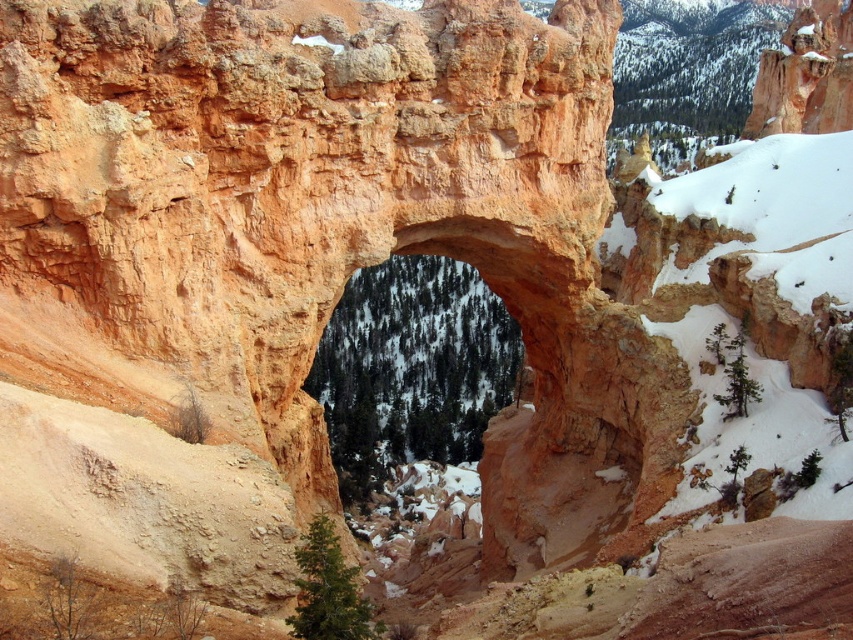
Question: Does green textured tree at center have a lesser width compared to green matte tree at upper right?

Choices:
 (A) yes
 (B) no

Answer: (B)

Question: Among these points, which one is nearest to the camera?

Choices:
 (A) (373, 346)
 (B) (751, 394)
 (C) (73, 611)
 (D) (345, 621)

Answer: (D)

Question: Does green matte tree at lower left appear on the left side of green matte tree at upper right?

Choices:
 (A) no
 (B) yes

Answer: (B)

Question: Does green textured tree at center appear under green matte tree at lower center?

Choices:
 (A) yes
 (B) no

Answer: (B)

Question: Which point is farther from the camera taking this photo?

Choices:
 (A) (318, 554)
 (B) (62, 618)
 (C) (434, 330)

Answer: (C)

Question: Which object is positioned closest to the green matte tree at lower center?

Choices:
 (A) green textured tree at center
 (B) green matte tree at upper right
 (C) green matte tree at lower left

Answer: (C)